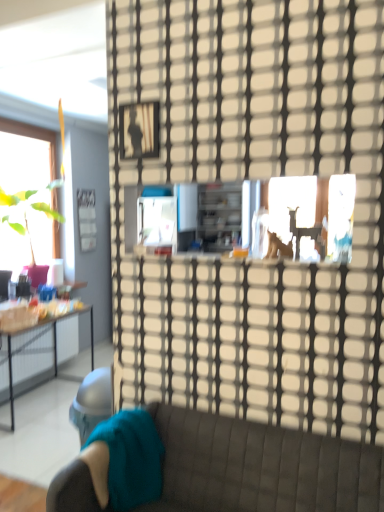
Question: Can you confirm if transparent glass door at center is positioned to the right of teal fabric pillow at lower left?

Choices:
 (A) no
 (B) yes

Answer: (B)

Question: From a real-world perspective, is transparent glass door at center positioned under teal fabric pillow at lower left based on gravity?

Choices:
 (A) no
 (B) yes

Answer: (A)

Question: Is transparent glass door at center not close to teal fabric pillow at lower left?

Choices:
 (A) no
 (B) yes

Answer: (A)

Question: Is the depth of transparent glass door at center less than that of teal fabric pillow at lower left?

Choices:
 (A) yes
 (B) no

Answer: (A)

Question: Can you confirm if transparent glass door at center is wider than teal fabric pillow at lower left?

Choices:
 (A) no
 (B) yes

Answer: (A)

Question: Is transparent glass door at center placed right next to teal fabric pillow at lower left?

Choices:
 (A) no
 (B) yes

Answer: (A)

Question: Is velvet teal studio couch at lower left next to teal fabric pillow at lower left and touching it?

Choices:
 (A) yes
 (B) no

Answer: (B)

Question: From a real-world perspective, is velvet teal studio couch at lower left physically below teal fabric pillow at lower left?

Choices:
 (A) no
 (B) yes

Answer: (B)

Question: From the image's perspective, is velvet teal studio couch at lower left located above teal fabric pillow at lower left?

Choices:
 (A) yes
 (B) no

Answer: (B)

Question: Is velvet teal studio couch at lower left shorter than teal fabric pillow at lower left?

Choices:
 (A) no
 (B) yes

Answer: (A)

Question: Is velvet teal studio couch at lower left thinner than teal fabric pillow at lower left?

Choices:
 (A) yes
 (B) no

Answer: (B)

Question: Is velvet teal studio couch at lower left taller than teal fabric pillow at lower left?

Choices:
 (A) yes
 (B) no

Answer: (A)

Question: Does velvet teal studio couch at lower left have a greater width compared to transparent glass door at center?

Choices:
 (A) yes
 (B) no

Answer: (A)